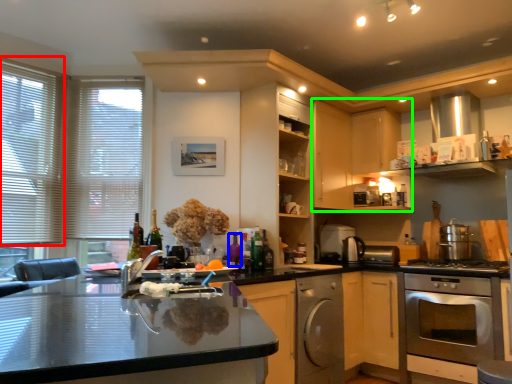
Question: Based on their relative distances, which object is nearer to window (highlighted by a red box)? Choose from bottle (highlighted by a blue box) and cabinetry (highlighted by a green box).

Choices:
 (A) bottle
 (B) cabinetry

Answer: (A)